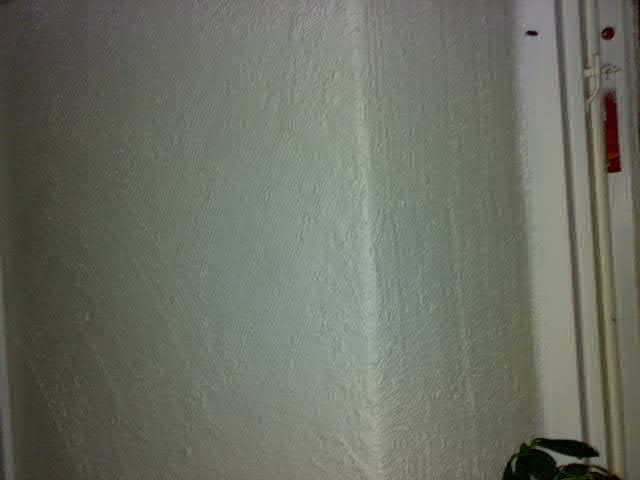
Locate an element on the screen. This screenshot has height=480, width=640. white plaster like walls is located at coordinates (425, 172), (131, 230).